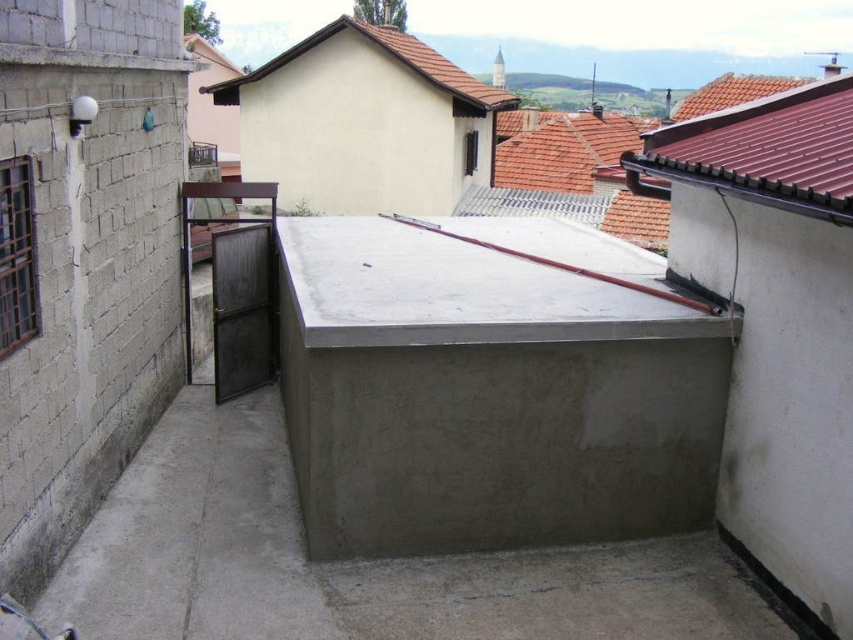
Question: Is the position of gray concrete at center more distant than that of brown tile roof at upper right?

Choices:
 (A) yes
 (B) no

Answer: (B)

Question: Which point is closer to the camera taking this photo?

Choices:
 (A) (471, 600)
 (B) (640, 182)
 (C) (318, 35)

Answer: (A)

Question: Which is nearer to the brown tile roof at upper right?

Choices:
 (A) brown tile roof at upper center
 (B) gray concrete at center

Answer: (B)

Question: Does gray concrete at center come in front of brown tile roof at upper right?

Choices:
 (A) yes
 (B) no

Answer: (A)

Question: Does gray concrete at center have a lesser width compared to brown tile roof at upper right?

Choices:
 (A) yes
 (B) no

Answer: (B)

Question: Which point is closer to the camera?

Choices:
 (A) (161, 424)
 (B) (235, 80)
 (C) (840, 205)

Answer: (C)